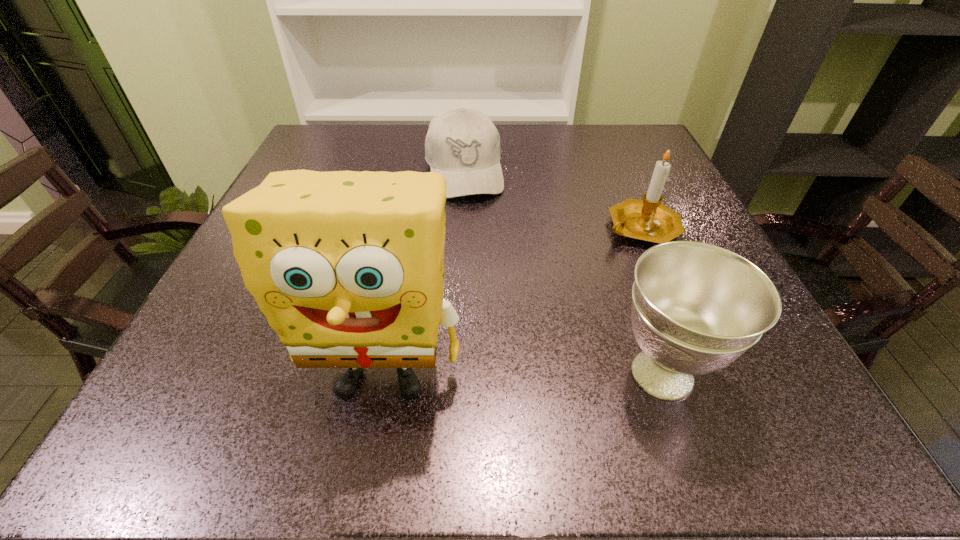
What are the coordinates of `vacant region located 0.200m on the front-facing side of the farthest object` in the screenshot? It's located at point(481,264).

At what (x,y) coordinates should I click in order to perform the action: click on free space located on the front-facing side of the farthest object. Please return your answer as a coordinate pair (x, y). Looking at the image, I should click on (475, 238).

You are a GUI agent. You are given a task and a screenshot of the screen. Output one action in this format:
    pyautogui.click(x=<x>, y=<y>)
    Task: Click on the object positioned at the far edge
    Image resolution: width=960 pixels, height=540 pixels.
    Given the screenshot: What is the action you would take?
    pyautogui.click(x=463, y=145)

Find the location of a particular element. This screenshot has height=540, width=960. sponge that is positioned at the near edge is located at coordinates (348, 267).

At what (x,y) coordinates should I click in order to perform the action: click on chalice at the near edge. Please return your answer as a coordinate pair (x, y). This screenshot has width=960, height=540. Looking at the image, I should click on (696, 307).

Find the location of a particular element. chalice that is at the right edge is located at coordinates (696, 307).

The image size is (960, 540). Find the location of `candle holder positioned at the right edge`. candle holder positioned at the right edge is located at coordinates (648, 220).

Where is `object situated at the near right corner`? The height and width of the screenshot is (540, 960). object situated at the near right corner is located at coordinates (696, 307).

This screenshot has height=540, width=960. Identify the location of blank space at the far edge of the desktop. (425, 125).

In order to click on vacant space at the far left corner of the desktop in this screenshot , I will do `click(352, 140)`.